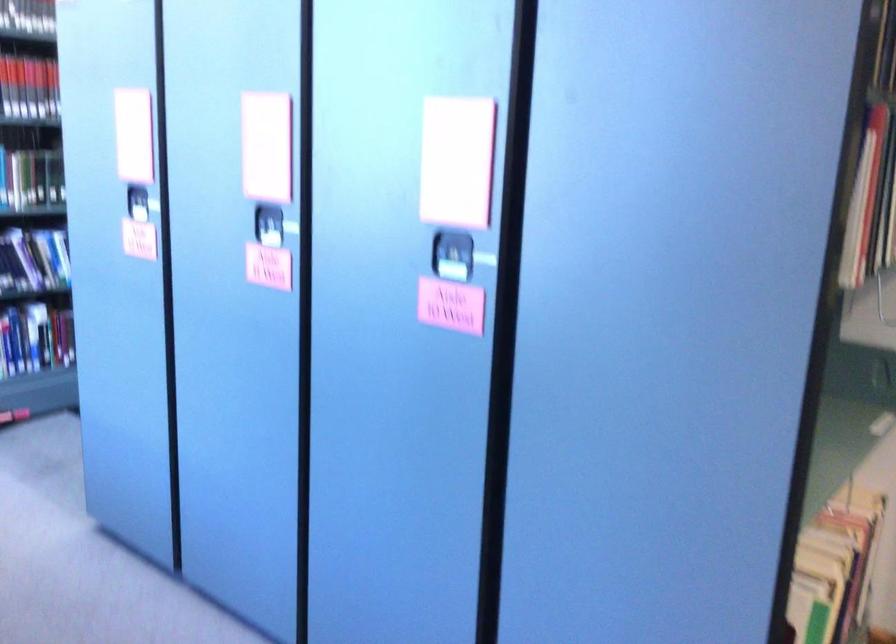
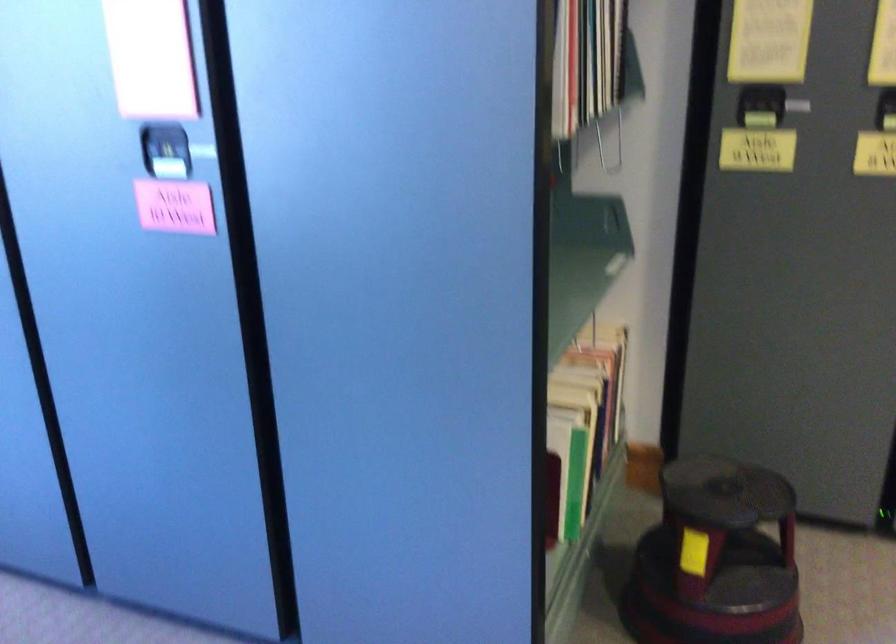
Question: The first image is from the beginning of the video and the second image is from the end. How did the camera likely rotate when shooting the video?

Choices:
 (A) Left
 (B) Right
 (C) Up
 (D) Down

Answer: (B)